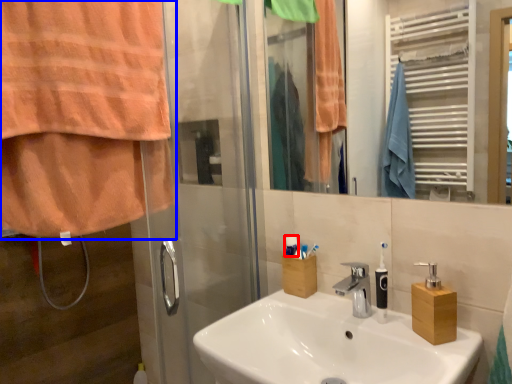
Question: Which of the following is the closest to the observer, toiletry (highlighted by a red box) or curtain (highlighted by a blue box)?

Choices:
 (A) toiletry
 (B) curtain

Answer: (B)